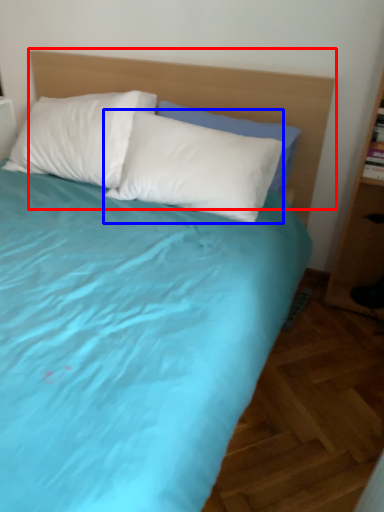
Question: Which object appears closest to the camera in this image, headboard (highlighted by a red box) or pillow (highlighted by a blue box)?

Choices:
 (A) headboard
 (B) pillow

Answer: (A)